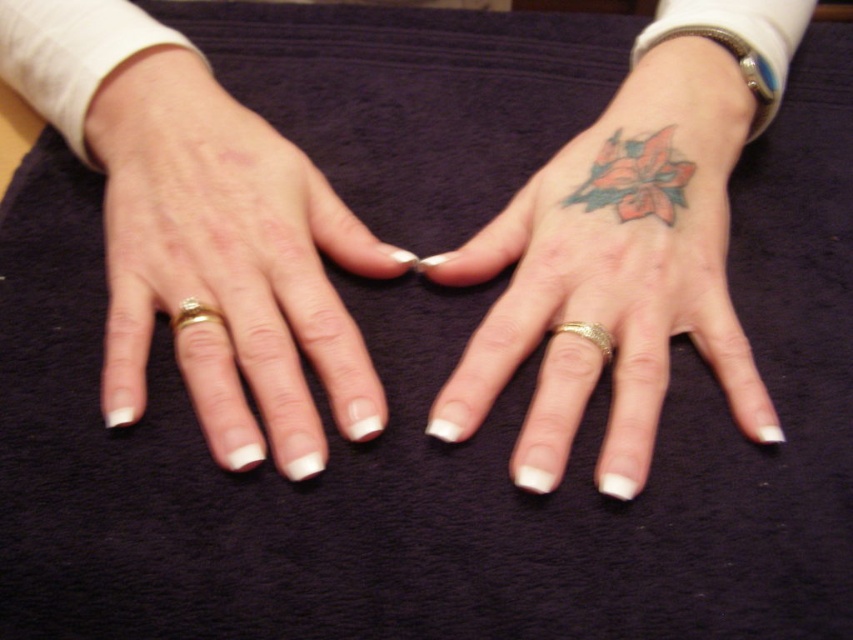
Please describe the exact position of the gold textured band at right middle finger in the image using coordinates. The scene has two hands on a purple fabric surface with a white shirt and rolled sleeves. The left hand has a gold ring and white nails, while the right hand has a flower tattoo near the wrist. The lighting is soft and even. You must use the object labels from the Objects section exactly as given. Your answer must include the coordinates from the Objects Description.

The gold textured band at right middle finger is located at coordinates point (589, 336).

Looking at this image, you need to identify which object is closer to the viewer based on their positions. Which one is closer between the colored tattoo at upper right and the white matte ring at left?

The colored tattoo at upper right is positioned over the white matte ring at left, meaning it is closer to the viewer.

You are a photographer adjusting the focus on your camera. You want to capture a clear image of the point at coordinates point (639, 308). If your camera has a maximum focus range of 15 inches, will you need to adjust your position?

The point at coordinates point (639, 308) is 16.30 inches from the camera, which exceeds the maximum focus range of 15 inches. Therefore, you need to move closer to the subject to ensure it is within the focus range.